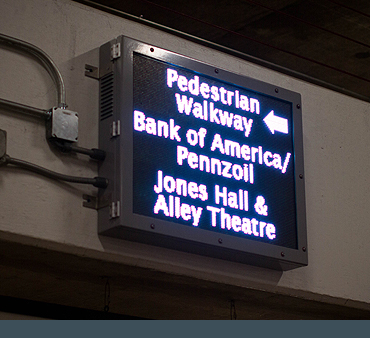
At what (x,y) coordinates should I click in order to perform the action: click on hinge. Please return your answer as a coordinate pair (x, y). The width and height of the screenshot is (370, 338). Looking at the image, I should click on (115, 54), (114, 137), (111, 205).